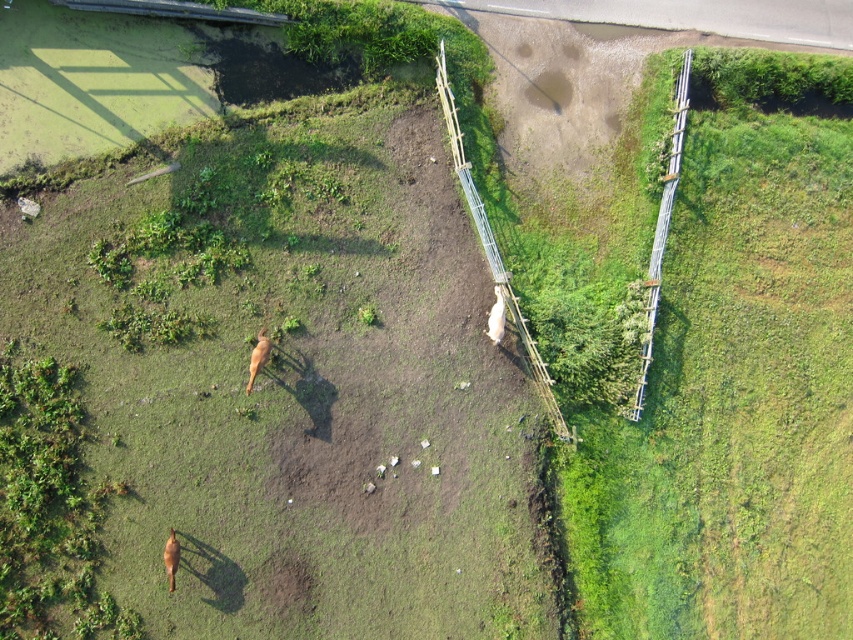
You are a farmer checking the fence on your property. You notice the wooden planks at center and the wooden fence at right. Which structure is taller?

The wooden planks at center are taller than the wooden fence at right.

You are a drone operator trying to capture a photo of the wooden planks at center from above. Based on the scene, where should you position the drone relative to the fenced area?

The wooden planks at center are located at point (492, 244), so you should position the drone above the fenced area to capture them from above.